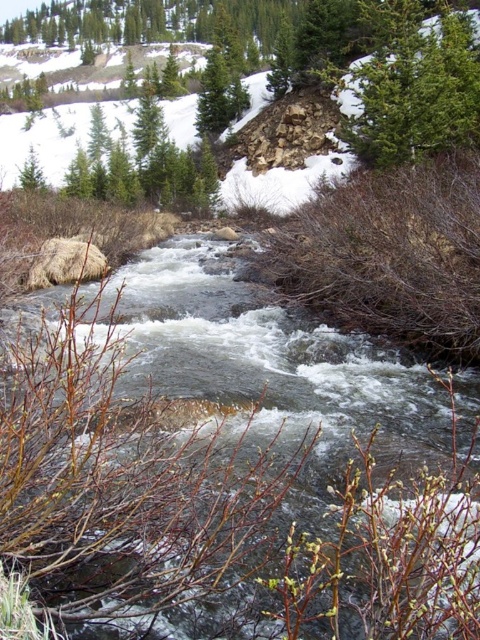
You are a hiker trying to cross the mountain stream. You see the clear water at center and the green textured evergreen tree at upper center. Which one is wider from your perspective?

The clear water at center is wider than the green textured evergreen tree at upper center from your perspective.

From the picture: You are a hiker trying to cross the mountain stream. You see the clear water at center and the green textured evergreen tree at upper center. Which object is closer to you as you stand on the bank?

The clear water at center is closer to you because it is in front of the green textured evergreen tree at upper center.